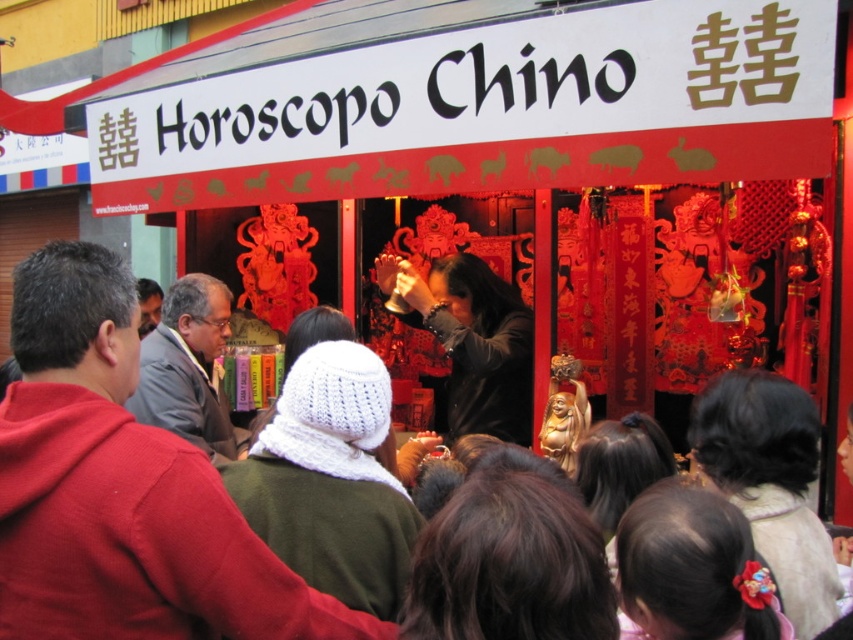
Looking at this image, where is the dark brown leather jacket at center located in the image?

The dark brown leather jacket at center is located at point (473, 340) in the image.